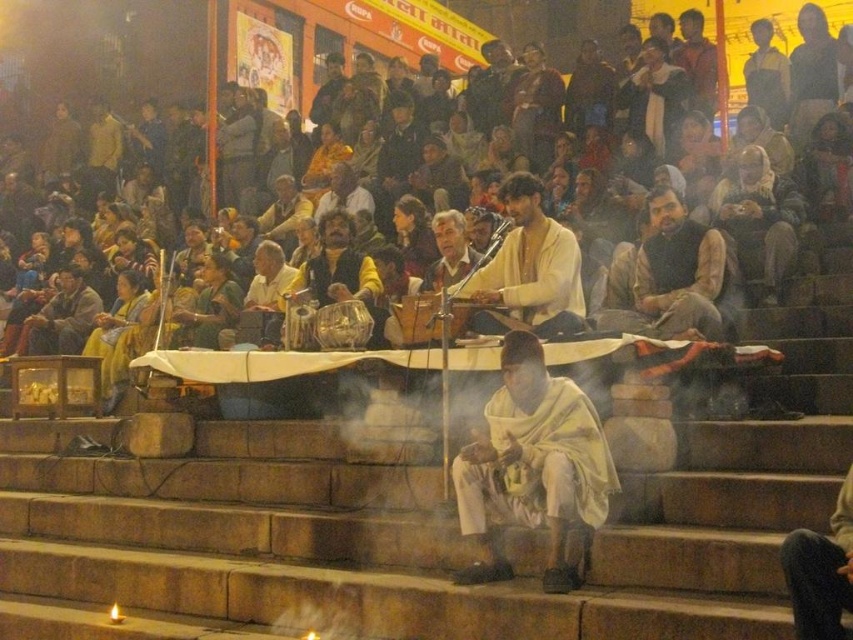
Can you confirm if white clothed man at center is positioned above dark brown leather jacket at lower left?

Incorrect, white clothed man at center is not positioned above dark brown leather jacket at lower left.

Does white clothed man at center appear on the right side of dark brown leather jacket at lower left?

Indeed, white clothed man at center is positioned on the right side of dark brown leather jacket at lower left.

Consider the image. Who is more forward, (x=598, y=481) or (x=32, y=332)?

Point (x=598, y=481) is more forward.

Where is `white clothed man at center`? white clothed man at center is located at coordinates (532, 467).

Which of these two, white clothed man at center or dark brown leather jacket at center, stands shorter?

dark brown leather jacket at center

Does white clothed man at center have a larger size compared to dark brown leather jacket at center?

Actually, white clothed man at center might be smaller than dark brown leather jacket at center.

Identify the location of white clothed man at center. Image resolution: width=853 pixels, height=640 pixels. pyautogui.click(x=532, y=467).

The height and width of the screenshot is (640, 853). In order to click on white clothed man at center in this screenshot , I will do `click(532, 467)`.

Can you confirm if white clothed man at center is shorter than light brown fabric at center?

No.

Does white clothed man at center have a smaller size compared to light brown fabric at center?

Actually, white clothed man at center might be larger than light brown fabric at center.

Which is in front, point (579, 492) or point (524, 314)?

Positioned in front is point (579, 492).

Image resolution: width=853 pixels, height=640 pixels. Identify the location of white clothed man at center. (532, 467).